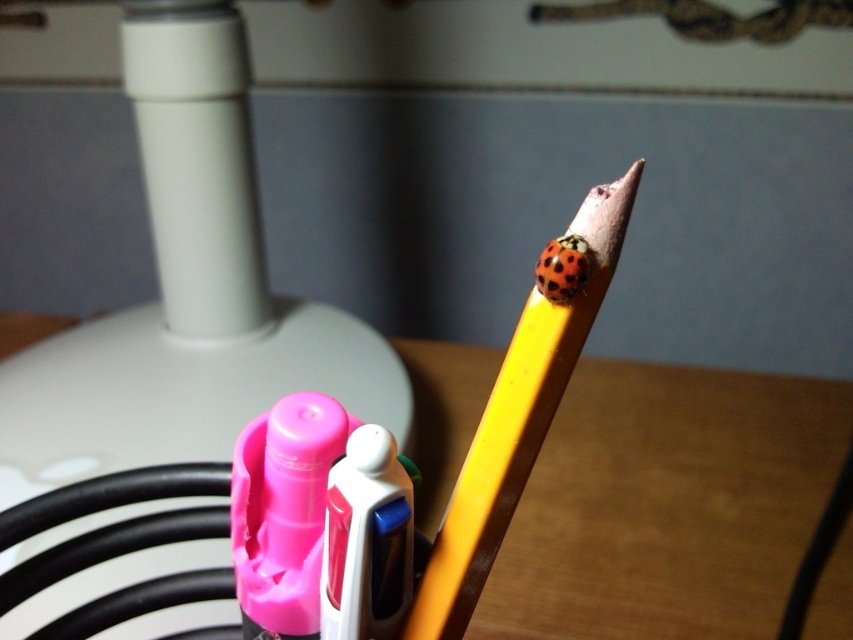
Does wooden table at center appear on the right side of yellow wood pencil at upper center?

Correct, you'll find wooden table at center to the right of yellow wood pencil at upper center.

Find the location of a particular element. wooden table at center is located at coordinates (668, 502).

Find the location of a particular element. wooden table at center is located at coordinates (668, 502).

This screenshot has height=640, width=853. Find the location of `wooden table at center`. wooden table at center is located at coordinates (668, 502).